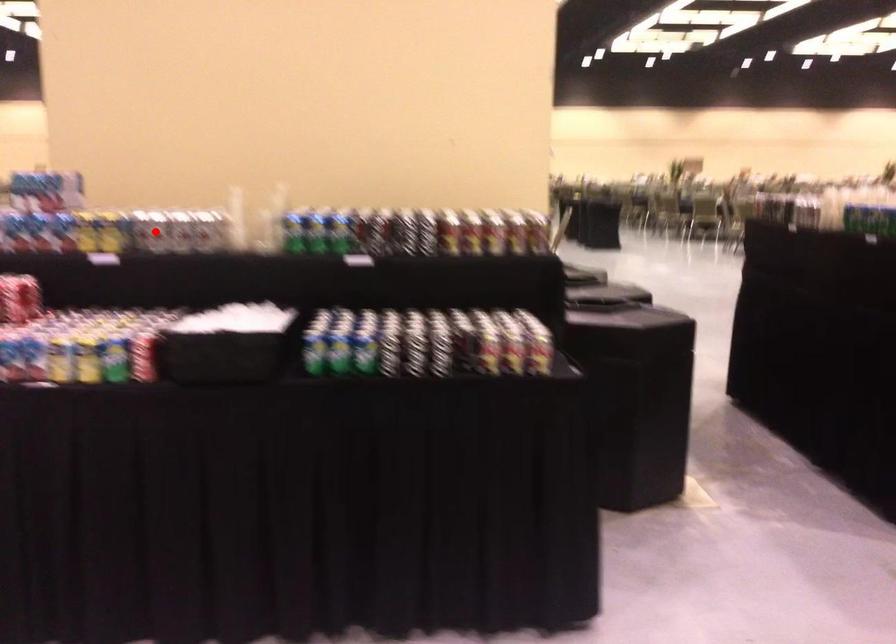
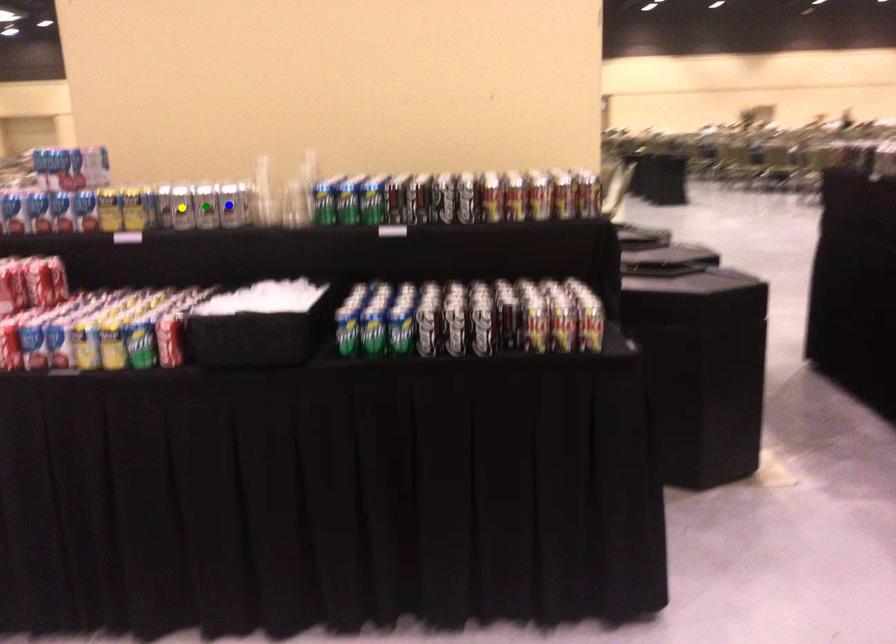
Question: I am providing you with two images of the same scene from different viewpoints. A red point is marked on the first image. You are given multiple points on the second image. Which point in image 2 is actually the same real-world point as the red point in image 1?

Choices:
 (A) blue point
 (B) yellow point
 (C) green point

Answer: (B)